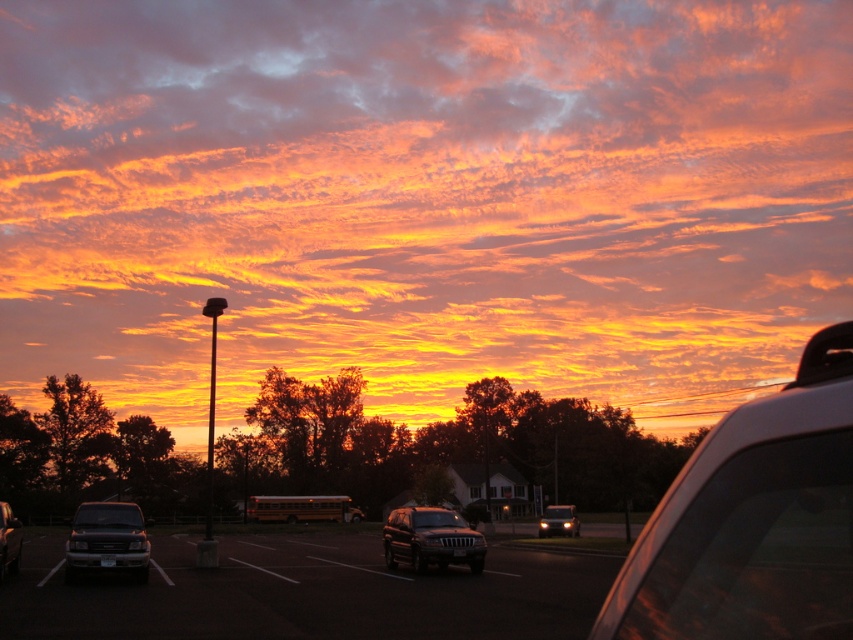
You are standing at point A, which is located at the coordinates point (x=431, y=540). You want to walk towards the direction of the sunset. Which object will you first encounter along your path?

The first object you will encounter along your path is the satin black suv at center, as it is located exactly at point (x=431, y=540) where you are standing.

You are a driver trying to exit the parking lot and see the white glossy car at right and the metallic silver suv at lower left. Which vehicle is positioned lower in the image?

The white glossy car at right is located below the metallic silver suv at lower left, so it is positioned lower in the image.